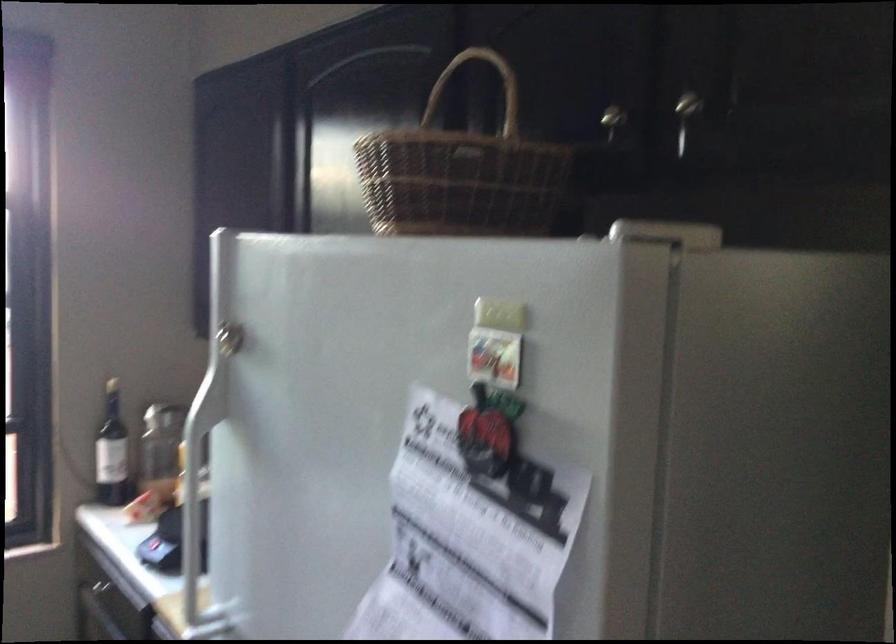
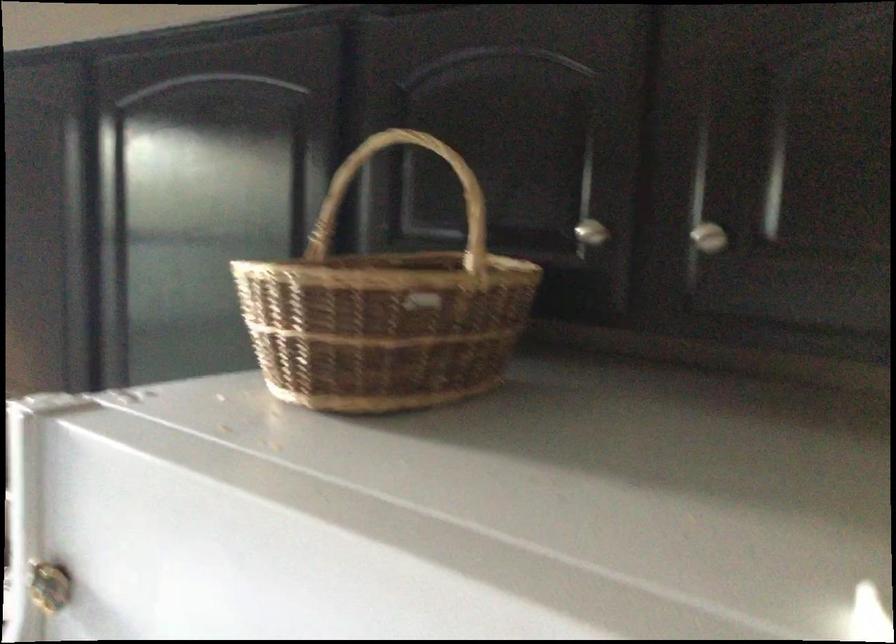
Where in the second image is the point corresponding to point (686, 93) from the first image?

(709, 238)